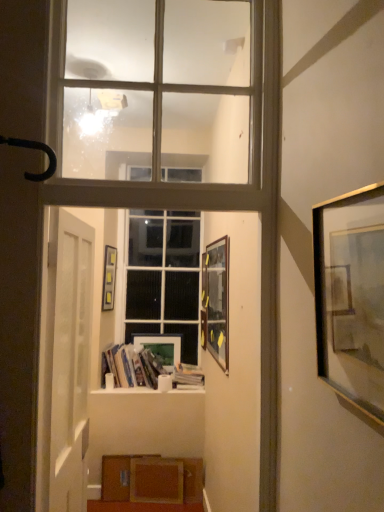
Question: Which direction should I rotate to look at clear glass window at upper center, which is counted as the 1th window, starting from the front?

Choices:
 (A) right
 (B) left

Answer: (B)

Question: In which direction should I rotate to look at white paper stack at center, the first book positioned from the right?

Choices:
 (A) left
 (B) right

Answer: (A)

Question: Considering the relative positions of matte wooden picture frame at center, positioned as the 4th picture frame in front-to-back order, and hardcover books at center, the first book in the left-to-right sequence, in the image provided, is matte wooden picture frame at center, positioned as the 4th picture frame in front-to-back order, to the right of hardcover books at center, the first book in the left-to-right sequence, from the viewer's perspective?

Choices:
 (A) yes
 (B) no

Answer: (A)

Question: Does matte wooden picture frame at center, arranged as the third picture frame when viewed from the right, have a greater height compared to hardcover books at center, the first book in the left-to-right sequence?

Choices:
 (A) no
 (B) yes

Answer: (B)

Question: Is matte wooden picture frame at center, positioned as the 4th picture frame in front-to-back order, positioned with its back to hardcover books at center, placed as the 2th book when sorted from right to left?

Choices:
 (A) no
 (B) yes

Answer: (A)

Question: Considering the relative sizes of matte wooden picture frame at center, arranged as the third picture frame when viewed from the right, and hardcover books at center, the first book in the left-to-right sequence, in the image provided, is matte wooden picture frame at center, arranged as the third picture frame when viewed from the right, shorter than hardcover books at center, the first book in the left-to-right sequence,?

Choices:
 (A) no
 (B) yes

Answer: (A)

Question: Is there a large distance between matte wooden picture frame at center, the 1th picture frame viewed from the back, and hardcover books at center, placed as the 2th book when sorted from right to left?

Choices:
 (A) yes
 (B) no

Answer: (B)

Question: Is matte wooden picture frame at center, positioned as the 4th picture frame in front-to-back order, facing towards hardcover books at center, the first book in the left-to-right sequence?

Choices:
 (A) no
 (B) yes

Answer: (B)

Question: From a real-world perspective, is hardcover books at center, the first book in the left-to-right sequence, positioned over white glass window at center, acting as the 1th window starting from the back, based on gravity?

Choices:
 (A) yes
 (B) no

Answer: (B)

Question: Is the depth of hardcover books at center, placed as the 2th book when sorted from right to left, greater than that of white glass window at center, the first window in the bottom-to-top sequence?

Choices:
 (A) no
 (B) yes

Answer: (A)

Question: Is hardcover books at center, the first book in the left-to-right sequence, not inside white glass window at center, the first window in the bottom-to-top sequence?

Choices:
 (A) no
 (B) yes

Answer: (B)

Question: Is white glass window at center, positioned as the 2th window in front-to-back order, surrounded by hardcover books at center, placed as the 2th book when sorted from right to left?

Choices:
 (A) no
 (B) yes

Answer: (A)

Question: From the image's perspective, would you say hardcover books at center, the first book in the left-to-right sequence, is positioned over white glass window at center, positioned as the 2th window in front-to-back order?

Choices:
 (A) yes
 (B) no

Answer: (B)

Question: From the image's perspective, is hardcover books at center, the first book in the left-to-right sequence, beneath white glass window at center, the first window in the bottom-to-top sequence?

Choices:
 (A) no
 (B) yes

Answer: (B)

Question: Is hardcover books at center, placed as the 2th book when sorted from right to left, outside of gold metallic picture frame at right, which is the 4th picture frame from back to front?

Choices:
 (A) yes
 (B) no

Answer: (A)